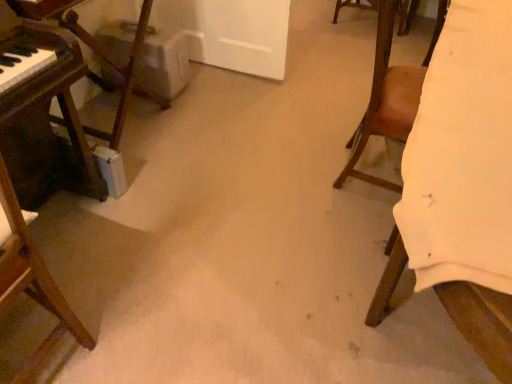
Question: In terms of size, does white fabric at right, the 2th furniture from the left, appear bigger or smaller than brown wooden chair at left, which is the 1th chair in left-to-right order?

Choices:
 (A) big
 (B) small

Answer: (A)

Question: Is white fabric at right, the 2th furniture from the left, inside the boundaries of brown wooden chair at left, the 2th chair from the right, or outside?

Choices:
 (A) inside
 (B) outside

Answer: (B)

Question: Which of these objects is positioned closest to the wooden piano at left, marked as the 1th furniture in a left-to-right arrangement?

Choices:
 (A) brown leather chair at right, the 1th chair from the right
 (B) white fabric at right, the 2th furniture from the left
 (C) brown wooden chair at left, which is the 1th chair in left-to-right order

Answer: (C)

Question: Which is farther from the brown wooden chair at left, which is the 1th chair in left-to-right order?

Choices:
 (A) brown leather chair at right, which is the second chair in left-to-right order
 (B) wooden piano at left, acting as the 2th furniture starting from the right
 (C) white fabric at right, the first furniture viewed from the right

Answer: (A)